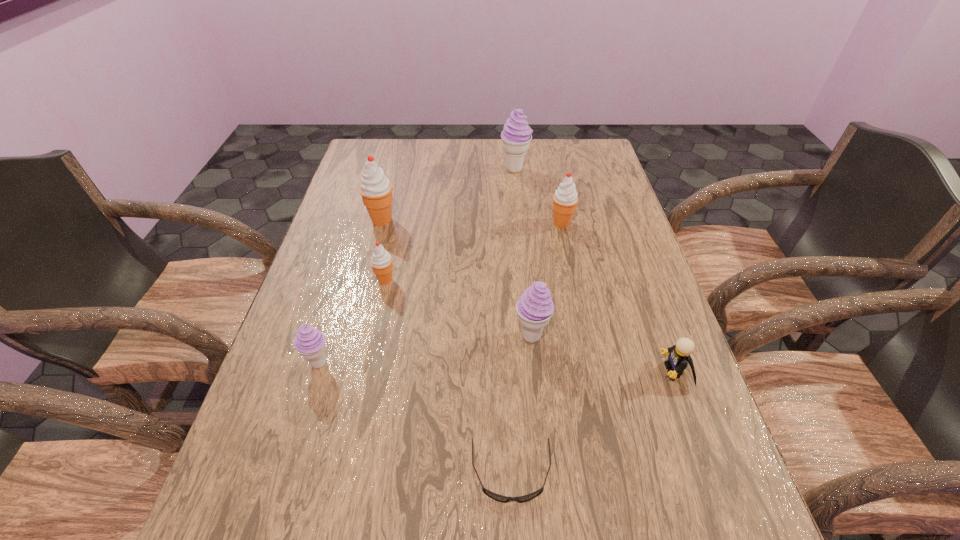
Locate an element on the screen. This screenshot has width=960, height=540. free region located on the front of the nearest icecream is located at coordinates (293, 451).

Where is `free spot located 0.340m on the front-facing side of the rightmost object`? This screenshot has height=540, width=960. free spot located 0.340m on the front-facing side of the rightmost object is located at coordinates (497, 370).

The width and height of the screenshot is (960, 540). Identify the location of vacant point located 0.110m on the front-facing side of the rightmost object. (608, 370).

Identify the location of vacant space situated on the front-facing side of the rightmost object. This screenshot has height=540, width=960. (468, 370).

At what (x,y) coordinates should I click in order to perform the action: click on object present at the far edge. Please return your answer as a coordinate pair (x, y). This screenshot has width=960, height=540. Looking at the image, I should click on (516, 135).

Locate an element on the screen. icecream positioned at the right edge is located at coordinates (565, 198).

At what (x,y) coordinates should I click in order to perform the action: click on Lego that is at the right edge. Please return your answer as a coordinate pair (x, y). The width and height of the screenshot is (960, 540). Looking at the image, I should click on (679, 354).

At what (x,y) coordinates should I click in order to perform the action: click on free space at the left edge of the desktop. Please return your answer as a coordinate pair (x, y). Looking at the image, I should click on [330, 340].

This screenshot has width=960, height=540. What are the coordinates of `free spot at the right edge of the desktop` in the screenshot? It's located at (646, 347).

Find the location of a particular element. free point between the nearest object and the farthest object is located at coordinates (513, 321).